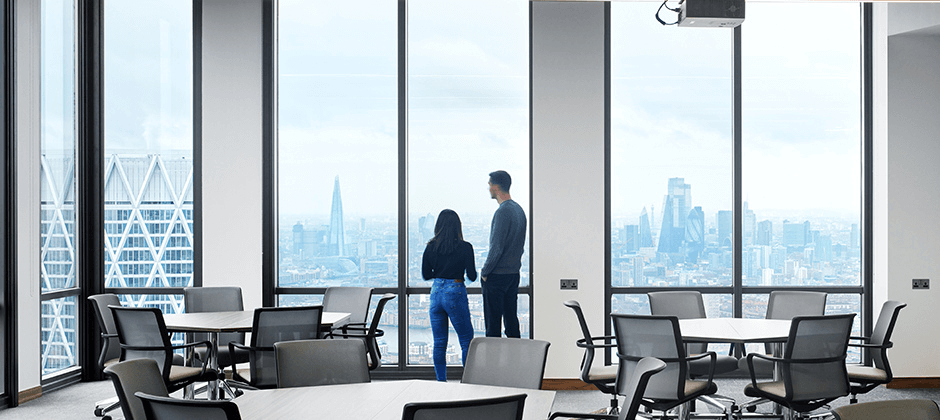
I want to click on window panel, so click(821, 159), click(684, 144), click(492, 126), click(347, 133), click(160, 121), click(61, 125).